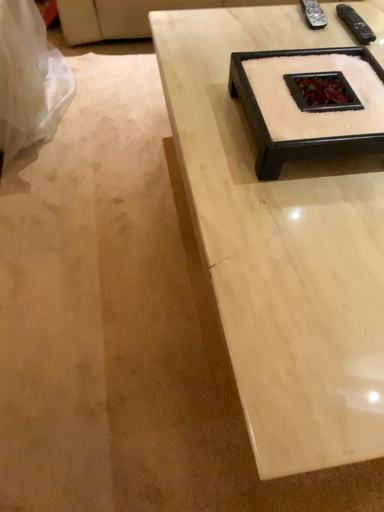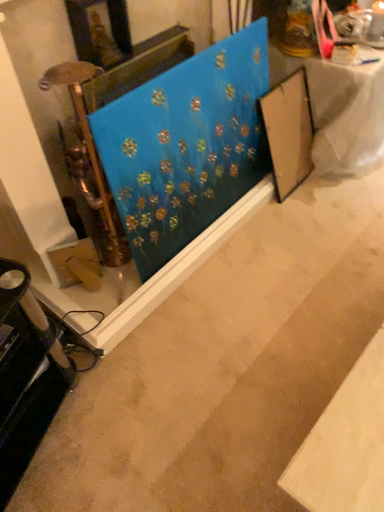
Question: How did the camera likely rotate when shooting the video?

Choices:
 (A) rotated downward
 (B) rotated upward

Answer: (B)